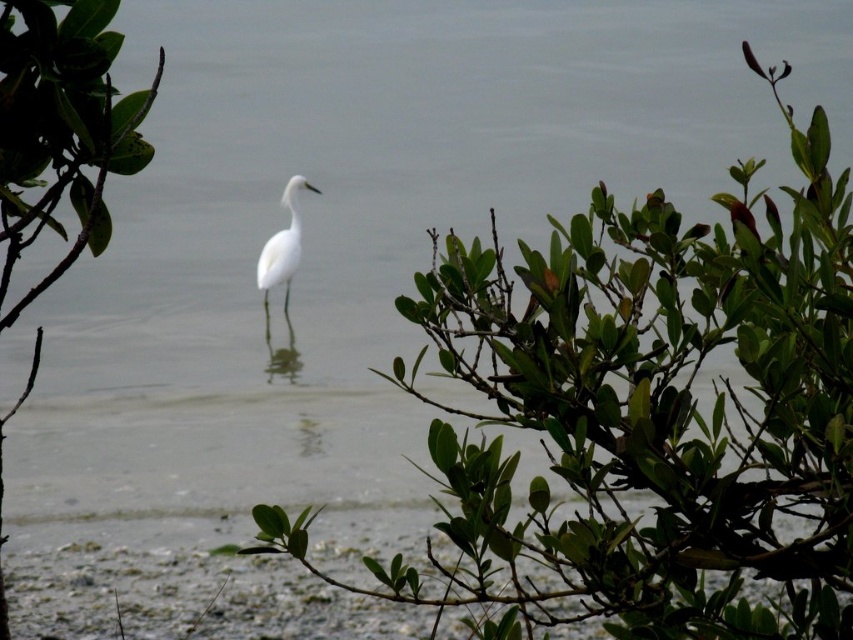
You are standing at the center of the image and see the point marked at coordinates (x=648, y=413). What object is located at that point?

The point at coordinates (x=648, y=413) marks the green leafy shrub at center.

Based on the photo, you are a photographer trying to capture the white bird in the center of the image. There is a green leafy shrub at center in the foreground. To avoid the shrub blocking the bird, where should you adjust your camera position? Please provide coordinates in the format of x,y where x is between 0 and 1 from left to right, and y is between 0 and 1 from bottom to top.

The green leafy shrub at center is located at coordinates [648,413]. To avoid blocking the bird, adjust your camera position to a point with a lower y value, such as 0.5, to ensure the shrub is below the bird in the frame.